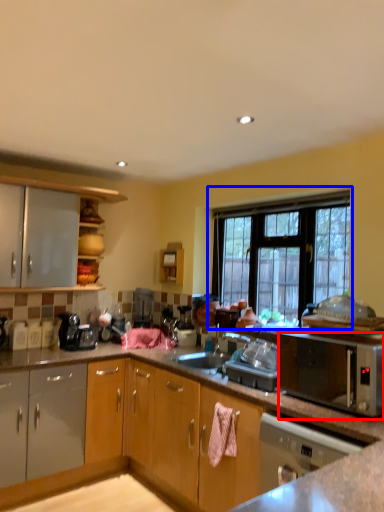
Question: Which object appears closest to the camera in this image, microwave oven (highlighted by a red box) or window (highlighted by a blue box)?

Choices:
 (A) microwave oven
 (B) window

Answer: (A)